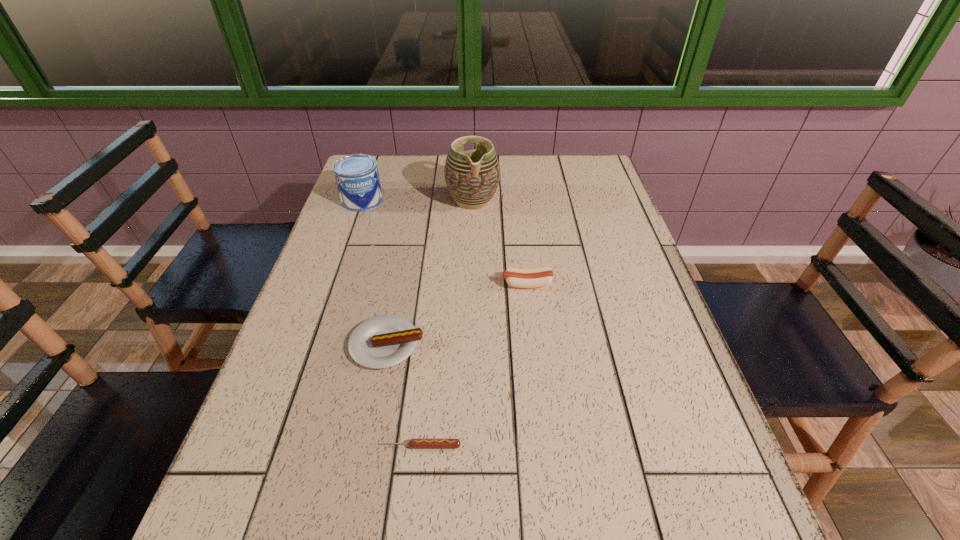
Where is `vacant space situated 0.190m on the front label of the can`? The image size is (960, 540). vacant space situated 0.190m on the front label of the can is located at coordinates (344, 252).

Identify the location of vacant region located 0.340m on the left of the third farthest object. This screenshot has width=960, height=540. (367, 284).

You are a GUI agent. You are given a task and a screenshot of the screen. Output one action in this format:
    pyautogui.click(x=<x>, y=<y>)
    Task: Click on the vacant position located on the right of the fourth farthest object
    This screenshot has width=960, height=540.
    Given the screenshot: What is the action you would take?
    pyautogui.click(x=451, y=344)

Image resolution: width=960 pixels, height=540 pixels. I want to click on free space located on the left of the nearest sausage, so click(356, 446).

Identify the location of pottery located in the far edge section of the desktop. tap(472, 177).

The height and width of the screenshot is (540, 960). What are the coordinates of `can that is at the far edge` in the screenshot? It's located at (357, 177).

Locate an element on the screen. can positioned at the left edge is located at coordinates (357, 177).

Find the location of a particular element. sausage located at the left edge is located at coordinates click(383, 341).

At what (x,y) coordinates should I click in order to perform the action: click on object present at the far left corner. Please return your answer as a coordinate pair (x, y). The image size is (960, 540). Looking at the image, I should click on (357, 177).

I want to click on vacant space at the far edge of the desktop, so click(x=540, y=188).